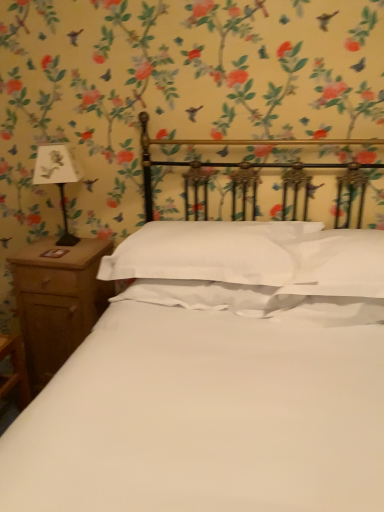
Question: Can you confirm if white paper at left is positioned to the left of brown wood nightstand at left?

Choices:
 (A) no
 (B) yes

Answer: (B)

Question: Is white paper at left aimed at brown wood nightstand at left?

Choices:
 (A) yes
 (B) no

Answer: (B)

Question: From the image's perspective, would you say white paper at left is shown under brown wood nightstand at left?

Choices:
 (A) no
 (B) yes

Answer: (A)

Question: Can you confirm if white paper at left is taller than brown wood nightstand at left?

Choices:
 (A) no
 (B) yes

Answer: (A)

Question: Is white paper at left positioned in front of brown wood nightstand at left?

Choices:
 (A) no
 (B) yes

Answer: (B)

Question: Is white paper at left inside the boundaries of white smooth pillow at center, or outside?

Choices:
 (A) inside
 (B) outside

Answer: (B)

Question: Is white paper at left in front of or behind white smooth pillow at center in the image?

Choices:
 (A) front
 (B) behind

Answer: (B)

Question: In terms of height, does white paper at left look taller or shorter compared to white smooth pillow at center?

Choices:
 (A) short
 (B) tall

Answer: (B)

Question: Is point (72, 161) positioned closer to the camera than point (125, 268)?

Choices:
 (A) closer
 (B) farther

Answer: (B)

Question: Is point (23, 279) positioned closer to the camera than point (38, 181)?

Choices:
 (A) farther
 (B) closer

Answer: (A)

Question: In the image, is brown wood nightstand at left on the left side or the right side of white paper at left?

Choices:
 (A) right
 (B) left

Answer: (A)

Question: Is brown wood nightstand at left taller or shorter than white paper at left?

Choices:
 (A) short
 (B) tall

Answer: (B)

Question: Considering the positions of brown wood nightstand at left and white paper at left in the image, is brown wood nightstand at left bigger or smaller than white paper at left?

Choices:
 (A) small
 (B) big

Answer: (B)

Question: Considering the positions of white smooth pillow at center and white paper at left in the image, is white smooth pillow at center taller or shorter than white paper at left?

Choices:
 (A) tall
 (B) short

Answer: (B)

Question: Is white smooth pillow at center spatially inside white paper at left, or outside of it?

Choices:
 (A) outside
 (B) inside

Answer: (A)